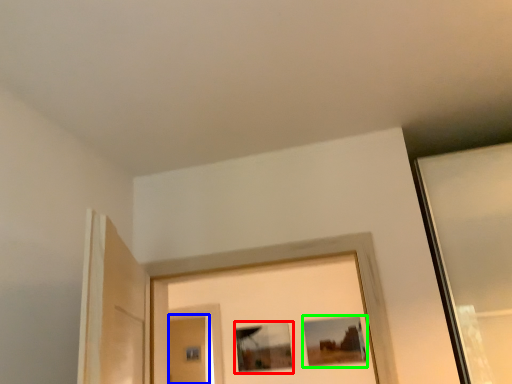
Question: Which object is the farthest from picture frame (highlighted by a red box)? Choose among these: screen door (highlighted by a blue box) or picture frame (highlighted by a green box).

Choices:
 (A) screen door
 (B) picture frame

Answer: (A)